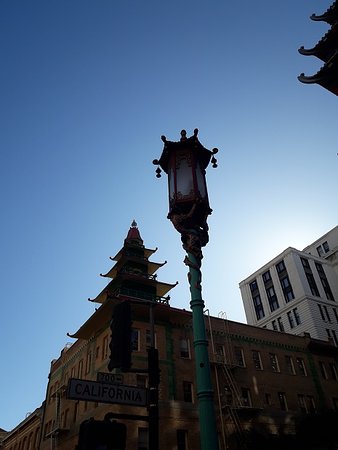
You are a GUI agent. You are given a task and a screenshot of the screen. Output one action in this format:
    pyautogui.click(x=<x>, y=<y>)
    Task: Click on the windows
    The image size is (338, 450).
    Given the screenshot: What is the action you would take?
    pyautogui.click(x=104, y=346), pyautogui.click(x=257, y=298), pyautogui.click(x=275, y=298), pyautogui.click(x=287, y=291), pyautogui.click(x=322, y=251)